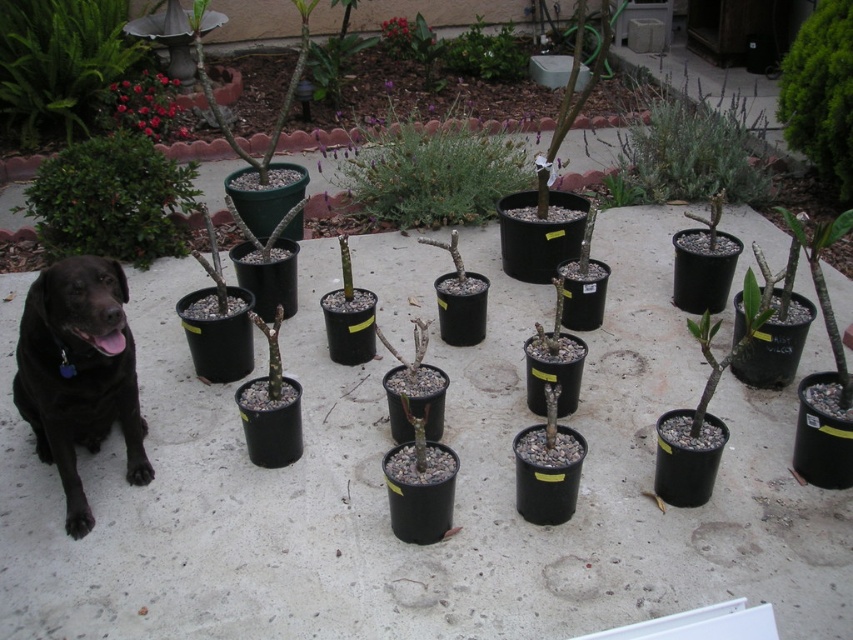
Question: Is black matte dog at lower left further to the viewer compared to green matte bush at upper left?

Choices:
 (A) no
 (B) yes

Answer: (A)

Question: Does black matte dog at lower left appear on the right side of green matte plant at right?

Choices:
 (A) no
 (B) yes

Answer: (A)

Question: Which point appears closest to the camera in this image?

Choices:
 (A) (3, 124)
 (B) (408, 196)
 (C) (689, 147)

Answer: (B)

Question: Does black matte dog at lower left lie behind gray fuzzy bush at upper center?

Choices:
 (A) no
 (B) yes

Answer: (A)

Question: Which object is the farthest from the green leafy bush at center?

Choices:
 (A) pink matte flowers at upper left
 (B) black matte dog at lower left
 (C) green matte plant at right
 (D) green matte bush at upper left

Answer: (C)

Question: Which point is farther to the camera?

Choices:
 (A) (839, 353)
 (B) (721, 136)

Answer: (B)